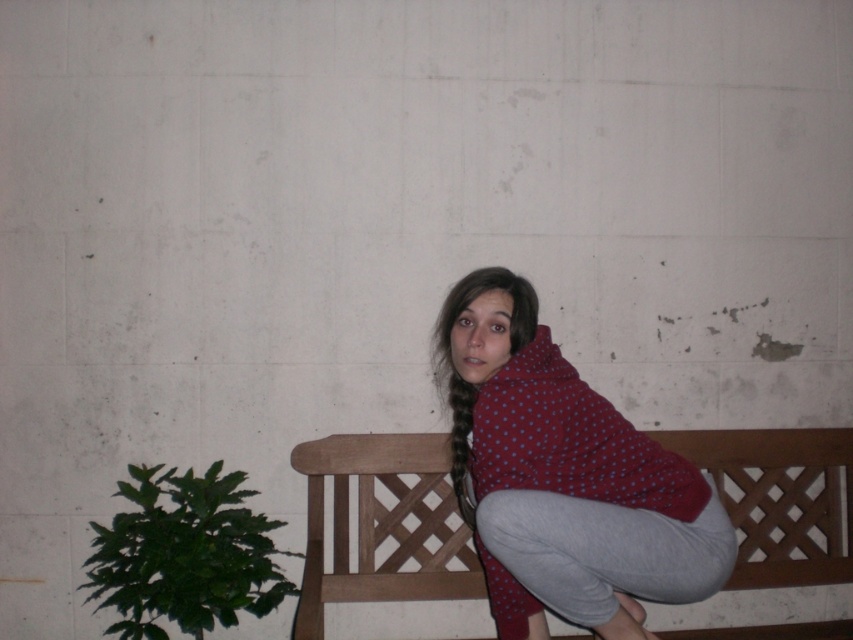
Question: Is polka dot fleece at center bigger than wooden at center?

Choices:
 (A) yes
 (B) no

Answer: (A)

Question: Which of the following is the farthest from the observer?

Choices:
 (A) polka dot fleece at center
 (B) wooden at center

Answer: (B)

Question: Which point appears closest to the camera in this image?

Choices:
 (A) (822, 484)
 (B) (492, 544)

Answer: (B)

Question: Which object is farther from the camera taking this photo?

Choices:
 (A) polka dot fleece at center
 (B) wooden at center

Answer: (B)

Question: Does polka dot fleece at center lie in front of wooden at center?

Choices:
 (A) yes
 (B) no

Answer: (A)

Question: Does polka dot fleece at center have a lesser width compared to wooden at center?

Choices:
 (A) yes
 (B) no

Answer: (A)